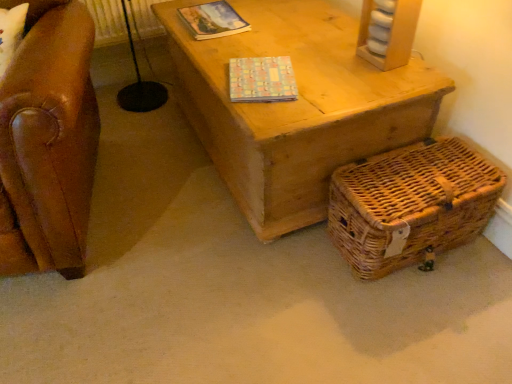
What is the approximate width of pastel mosaic-patterned book at center, which ranks as the second magazine in back-to-front order?

pastel mosaic-patterned book at center, which ranks as the second magazine in back-to-front order, is 8.03 inches in width.

The width and height of the screenshot is (512, 384). What do you see at coordinates (411, 205) in the screenshot? I see `woven brown basket at lower right` at bounding box center [411, 205].

Find the location of `pastel mosaic-patterned book at center, positioned as the first magazine in front-to-back order`. pastel mosaic-patterned book at center, positioned as the first magazine in front-to-back order is located at coordinates (262, 80).

Looking at the image, does multicolored paper book at upper center, the second magazine in the front-to-back sequence, seem bigger or smaller compared to woven brown basket at lower right?

multicolored paper book at upper center, the second magazine in the front-to-back sequence, is smaller than woven brown basket at lower right.

Is multicolored paper book at upper center, the 1th magazine viewed from the back, in contact with woven brown basket at lower right?

They are not placed beside each other.

Which is behind, point (239, 78) or point (340, 207)?

Point (239, 78)

Does pastel mosaic-patterned book at center, which ranks as the second magazine in back-to-front order, turn towards woven brown basket at lower right?

No, pastel mosaic-patterned book at center, which ranks as the second magazine in back-to-front order, is not turned towards woven brown basket at lower right.

Identify the location of basket that is in front of the pastel mosaic-patterned book at center, positioned as the first magazine in front-to-back order. (411, 205).

Considering the relative sizes of pastel mosaic-patterned book at center, positioned as the first magazine in front-to-back order, and woven brown basket at lower right in the image provided, is pastel mosaic-patterned book at center, positioned as the first magazine in front-to-back order, bigger than woven brown basket at lower right?

Actually, pastel mosaic-patterned book at center, positioned as the first magazine in front-to-back order, might be smaller than woven brown basket at lower right.

Measure the distance between woven brown basket at lower right and pastel mosaic-patterned book at center, which is the 1th magazine in bottom-to-top order.

woven brown basket at lower right and pastel mosaic-patterned book at center, which is the 1th magazine in bottom-to-top order, are 18.84 inches apart from each other.

Considering the relative sizes of woven brown basket at lower right and pastel mosaic-patterned book at center, which ranks as the second magazine in back-to-front order, in the image provided, is woven brown basket at lower right thinner than pastel mosaic-patterned book at center, which ranks as the second magazine in back-to-front order,?

Incorrect, the width of woven brown basket at lower right is not less than that of pastel mosaic-patterned book at center, which ranks as the second magazine in back-to-front order.

Where is `the 1st magazine behind the woven brown basket at lower right, starting your count from the anchor`? Image resolution: width=512 pixels, height=384 pixels. the 1st magazine behind the woven brown basket at lower right, starting your count from the anchor is located at coordinates (262, 80).

Is woven brown basket at lower right positioned far away from pastel mosaic-patterned book at center, which is the 1th magazine in bottom-to-top order?

That's not correct — woven brown basket at lower right is a little close to pastel mosaic-patterned book at center, which is the 1th magazine in bottom-to-top order.

Can you confirm if woven brown basket at lower right is thinner than multicolored paper book at upper center, which is the first magazine in top-to-bottom order?

No, woven brown basket at lower right is not thinner than multicolored paper book at upper center, which is the first magazine in top-to-bottom order.

Is the surface of woven brown basket at lower right in direct contact with multicolored paper book at upper center, the second magazine in the front-to-back sequence?

No, woven brown basket at lower right is not with multicolored paper book at upper center, the second magazine in the front-to-back sequence.

This screenshot has width=512, height=384. I want to click on basket that is in front of the multicolored paper book at upper center, which is the first magazine in top-to-bottom order, so click(411, 205).

Considering the positions of points (357, 165) and (215, 9), is point (357, 165) farther from camera compared to point (215, 9)?

No, (357, 165) is in front of (215, 9).

From a real-world perspective, which object rests below the other?

multicolored paper book at upper center, the second magazine in the front-to-back sequence, from a real-world perspective.

Is pastel mosaic-patterned book at center, which is the 1th magazine in bottom-to-top order, facing away from multicolored paper book at upper center, which is the second magazine in bottom-to-top order?

No, pastel mosaic-patterned book at center, which is the 1th magazine in bottom-to-top order, is not facing the opposite direction of multicolored paper book at upper center, which is the second magazine in bottom-to-top order.

Considering the sizes of pastel mosaic-patterned book at center, which ranks as the second magazine in back-to-front order, and multicolored paper book at upper center, which is the second magazine in bottom-to-top order, in the image, is pastel mosaic-patterned book at center, which ranks as the second magazine in back-to-front order, taller or shorter than multicolored paper book at upper center, which is the second magazine in bottom-to-top order,?

Clearly, pastel mosaic-patterned book at center, which ranks as the second magazine in back-to-front order, is taller compared to multicolored paper book at upper center, which is the second magazine in bottom-to-top order.

Is multicolored paper book at upper center, which is the second magazine in bottom-to-top order, positioned with its back to pastel mosaic-patterned book at center, marked as the second magazine in a top-to-bottom arrangement?

No, pastel mosaic-patterned book at center, marked as the second magazine in a top-to-bottom arrangement, is not at the back of multicolored paper book at upper center, which is the second magazine in bottom-to-top order.

Considering the positions of objects multicolored paper book at upper center, the second magazine in the front-to-back sequence, and pastel mosaic-patterned book at center, marked as the second magazine in a top-to-bottom arrangement, in the image provided, who is behind, multicolored paper book at upper center, the second magazine in the front-to-back sequence, or pastel mosaic-patterned book at center, marked as the second magazine in a top-to-bottom arrangement,?

multicolored paper book at upper center, the second magazine in the front-to-back sequence, is further from the camera.

From the image's perspective, between multicolored paper book at upper center, which is the first magazine in top-to-bottom order, and pastel mosaic-patterned book at center, which is the 1th magazine in bottom-to-top order, which one is located above?

multicolored paper book at upper center, which is the first magazine in top-to-bottom order, appears higher in the image.

From a real-world perspective, starting from the woven brown basket at lower right, which magazine is the 1st one vertically above it? Please provide its 2D coordinates.

[(213, 20)]

Image resolution: width=512 pixels, height=384 pixels. Identify the location of basket that appears in front of the pastel mosaic-patterned book at center, positioned as the first magazine in front-to-back order. (411, 205).

Looking at the image, which one is located closer to multicolored paper book at upper center, which is the first magazine in top-to-bottom order, woven brown basket at lower right or pastel mosaic-patterned book at center, which ranks as the second magazine in back-to-front order?

pastel mosaic-patterned book at center, which ranks as the second magazine in back-to-front order.

Estimate the real-world distances between objects in this image. Which object is closer to woven brown basket at lower right, pastel mosaic-patterned book at center, marked as the second magazine in a top-to-bottom arrangement, or multicolored paper book at upper center, the second magazine in the front-to-back sequence?

pastel mosaic-patterned book at center, marked as the second magazine in a top-to-bottom arrangement, lies closer to woven brown basket at lower right than the other object.

Based on their spatial positions, is woven brown basket at lower right or multicolored paper book at upper center, the 1th magazine viewed from the back, further from pastel mosaic-patterned book at center, positioned as the first magazine in front-to-back order?

woven brown basket at lower right is positioned further to the anchor pastel mosaic-patterned book at center, positioned as the first magazine in front-to-back order.

Based on their spatial positions, is multicolored paper book at upper center, which is the second magazine in bottom-to-top order, or woven brown basket at lower right closer to pastel mosaic-patterned book at center, marked as the second magazine in a top-to-bottom arrangement?

The object closer to pastel mosaic-patterned book at center, marked as the second magazine in a top-to-bottom arrangement, is multicolored paper book at upper center, which is the second magazine in bottom-to-top order.

Which object lies further to the anchor point woven brown basket at lower right, multicolored paper book at upper center, which is the first magazine in top-to-bottom order, or pastel mosaic-patterned book at center, which is the 1th magazine in bottom-to-top order?

Based on the image, multicolored paper book at upper center, which is the first magazine in top-to-bottom order, appears to be further to woven brown basket at lower right.

When comparing their distances from multicolored paper book at upper center, which is the second magazine in bottom-to-top order, does pastel mosaic-patterned book at center, positioned as the first magazine in front-to-back order, or woven brown basket at lower right seem further?

woven brown basket at lower right lies further to multicolored paper book at upper center, which is the second magazine in bottom-to-top order, than the other object.

In order to click on magazine between multicolored paper book at upper center, the second magazine in the front-to-back sequence, and woven brown basket at lower right from top to bottom in this screenshot , I will do `click(262, 80)`.